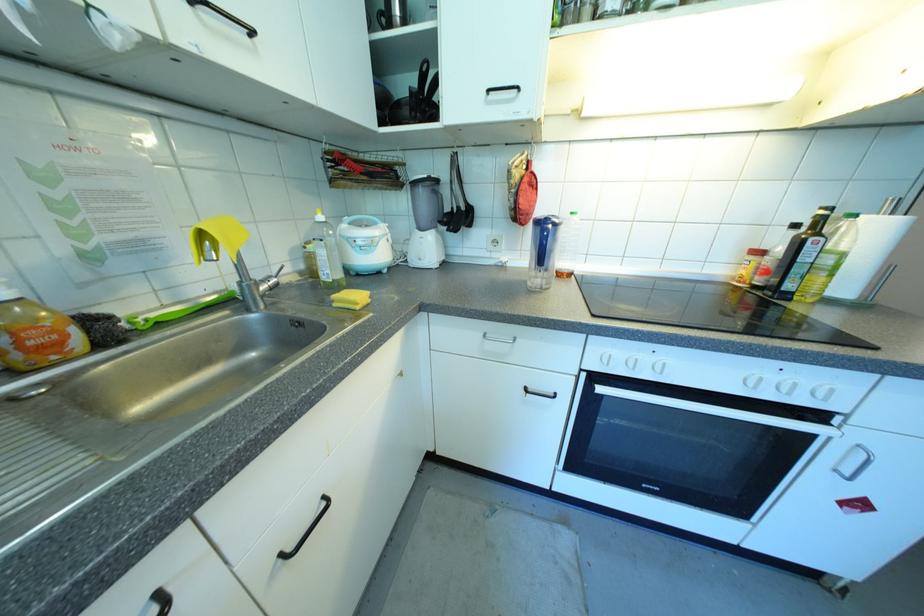
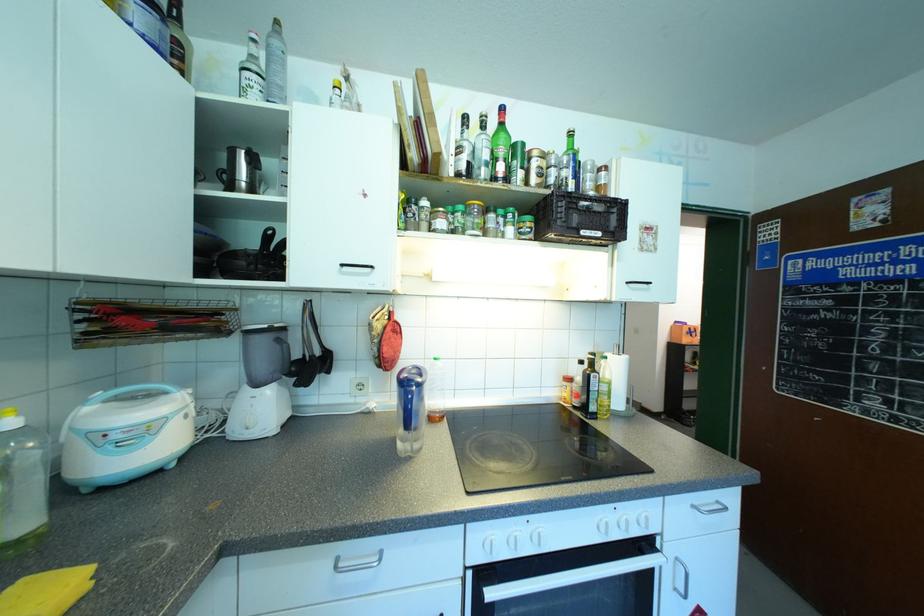
The point at (428, 248) is marked in the first image. Where is the corresponding point in the second image?

(262, 410)